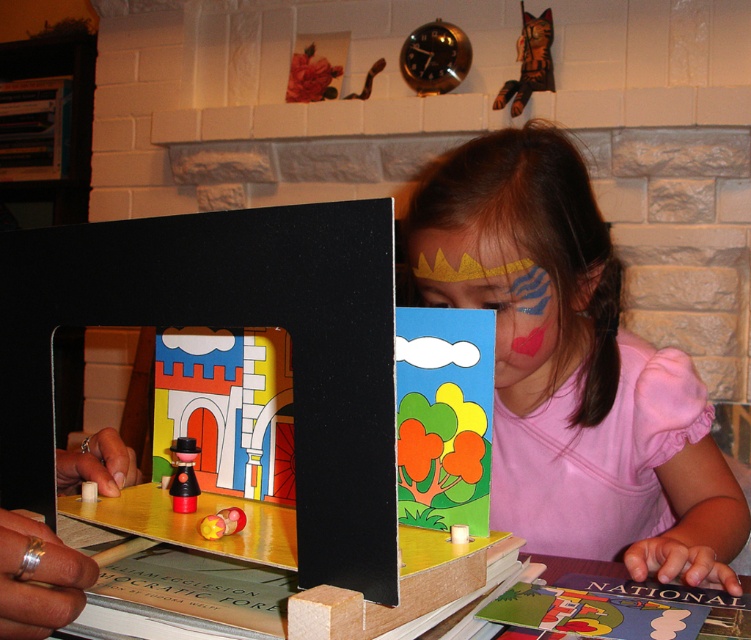
Who is more distant from viewer, (566, 419) or (526, 90)?

Point (526, 90)

Is point (526, 168) positioned behind point (550, 22)?

No, it is not.

The image size is (751, 640). Identify the location of pink fabric at center. (572, 368).

Does pink fabric at center have a greater width compared to smooth plastic toy at center?

Indeed, pink fabric at center has a greater width compared to smooth plastic toy at center.

Which of these two, pink fabric at center or smooth plastic toy at center, stands shorter?

smooth plastic toy at center

Is point (644, 531) less distant than point (216, 513)?

That is False.

I want to click on pink fabric at center, so click(572, 368).

Does brushed metal toy at center have a lesser width compared to smooth plastic toy at center?

No.

Is point (179, 448) farther from camera compared to point (225, 515)?

That is True.

Between point (176, 452) and point (225, 524), which one is positioned behind?

The point (176, 452) is behind.

I want to click on brushed metal toy at center, so click(x=182, y=476).